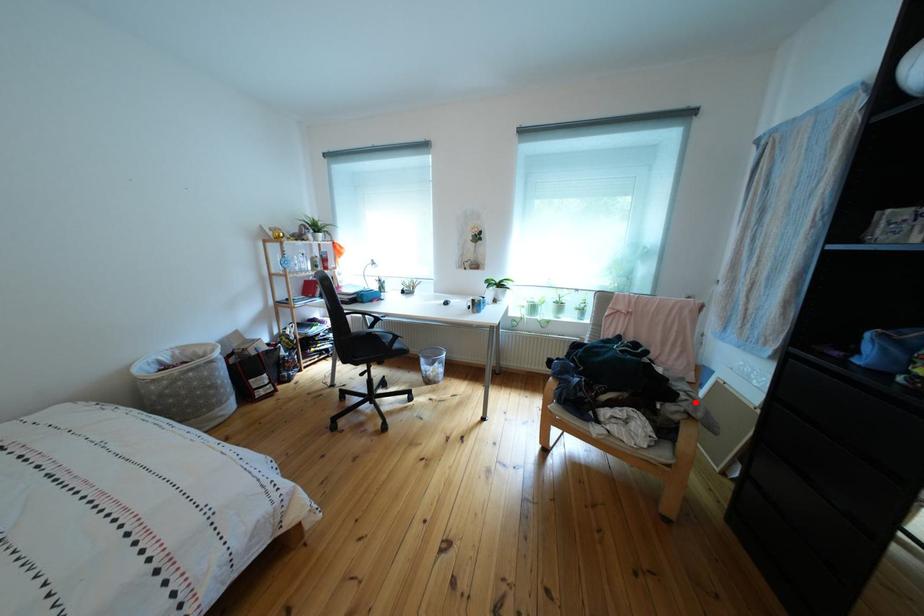
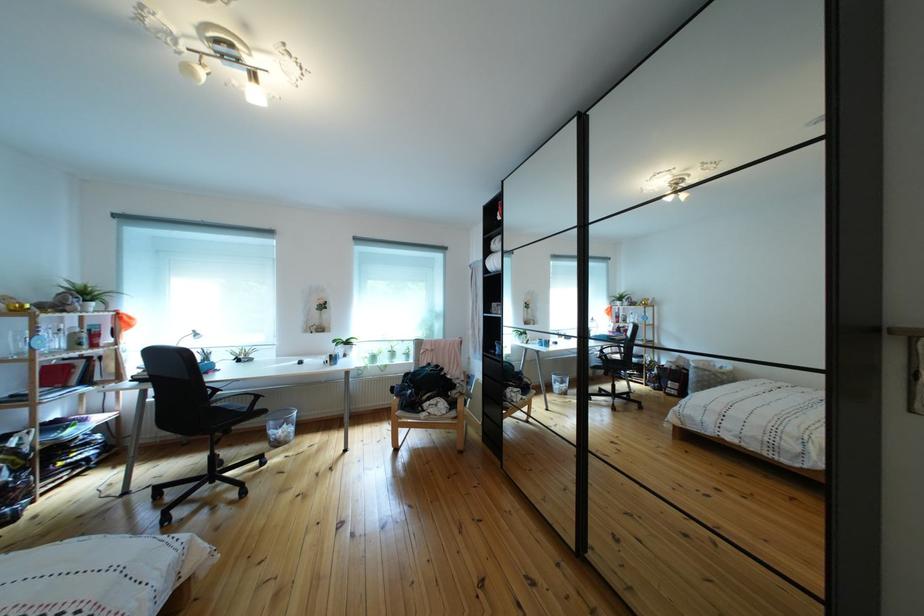
Locate, in the second image, the point that corresponds to the highlighted location in the first image.

(469, 391)